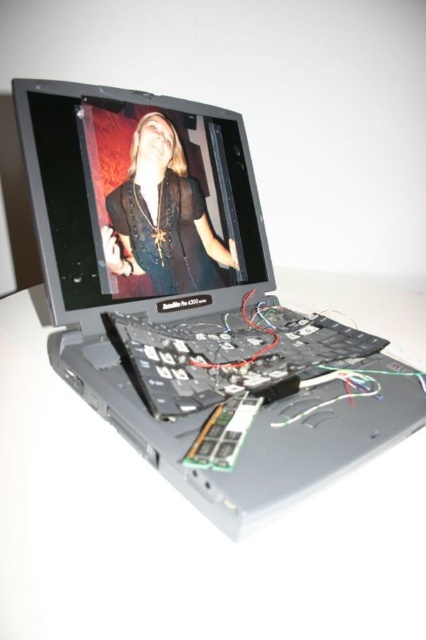
Question: Where is satin black laptop at center located in relation to black plastic keyboard at center in the image?

Choices:
 (A) above
 (B) below

Answer: (A)

Question: Can you confirm if black plastic keyboard at center is smaller than matte black shirt at center?

Choices:
 (A) yes
 (B) no

Answer: (B)

Question: Which object is the closest to the matte black shirt at center?

Choices:
 (A) black plastic keyboard at center
 (B) satin black laptop at center
 (C) matte black screen at center

Answer: (C)

Question: Considering the real-world distances, which object is closest to the satin black laptop at center?

Choices:
 (A) matte black shirt at center
 (B) black plastic keyboard at center
 (C) matte black screen at center

Answer: (C)

Question: Can you confirm if matte black screen at center is positioned to the right of matte black shirt at center?

Choices:
 (A) yes
 (B) no

Answer: (B)

Question: Which object appears closest to the camera in this image?

Choices:
 (A) black plastic keyboard at center
 (B) matte black screen at center
 (C) satin black laptop at center
 (D) matte black shirt at center

Answer: (C)